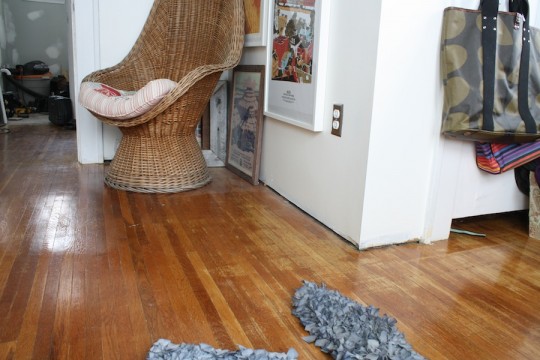
In order to click on portraits in this screenshot , I will do `click(243, 133)`, `click(306, 47)`, `click(259, 13)`, `click(208, 126)`.